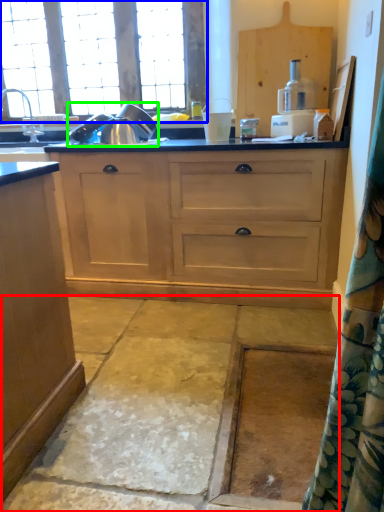
Question: Which is farther away from concrete (highlighted by a red box)? window (highlighted by a blue box) or appliance (highlighted by a green box)?

Choices:
 (A) window
 (B) appliance

Answer: (A)